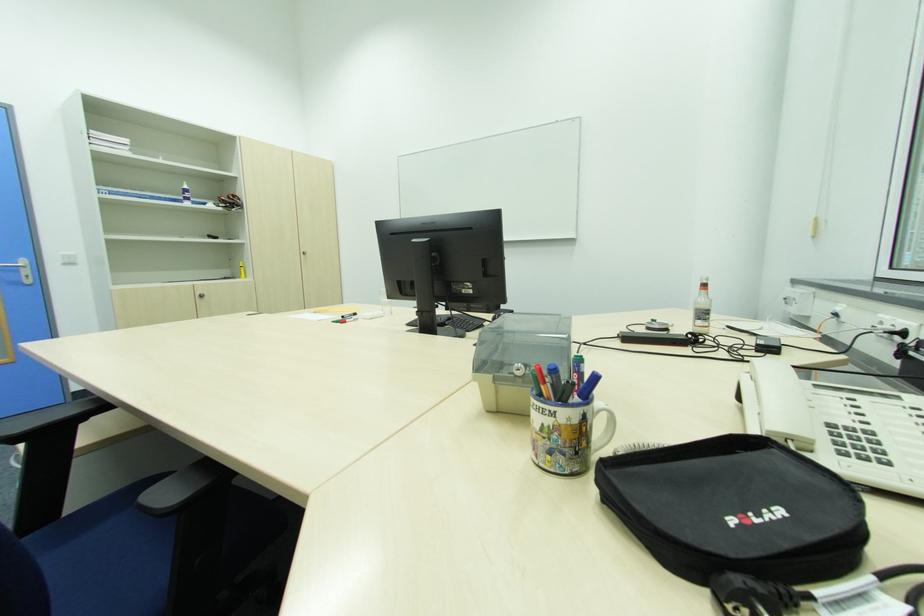
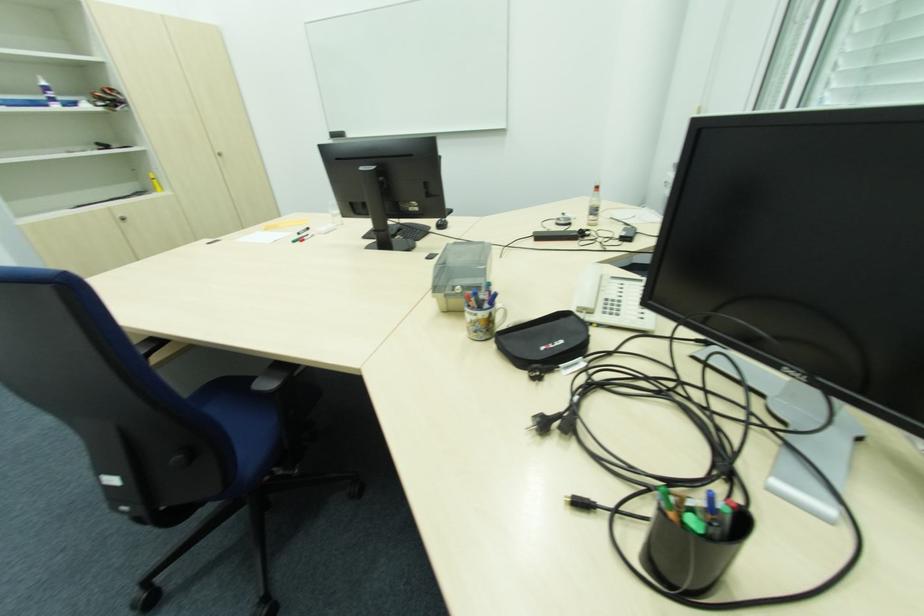
In the second image, find the point that corresponds to point 834,426 in the first image.

(610, 300)